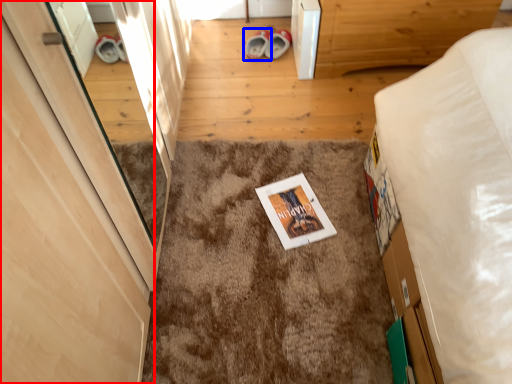
Question: Which point is closer to the camera, door (highlighted by a red box) or footwear (highlighted by a blue box)?

Choices:
 (A) door
 (B) footwear

Answer: (A)